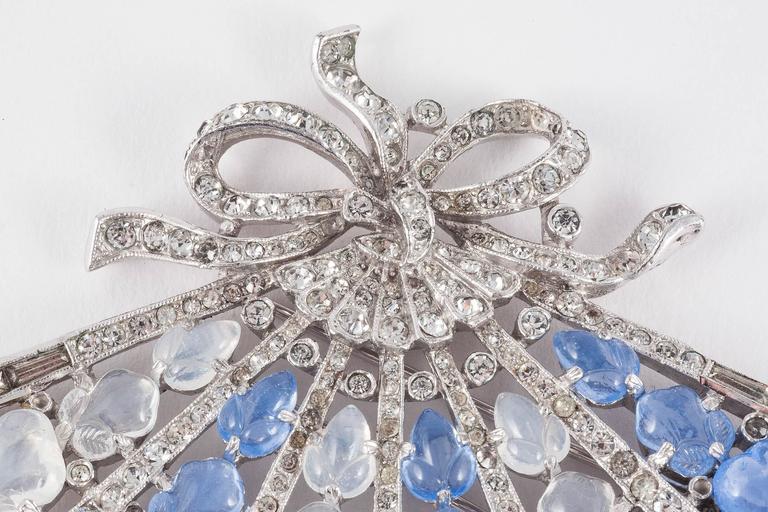
Image resolution: width=768 pixels, height=512 pixels. I want to click on gallery, so 408,315.